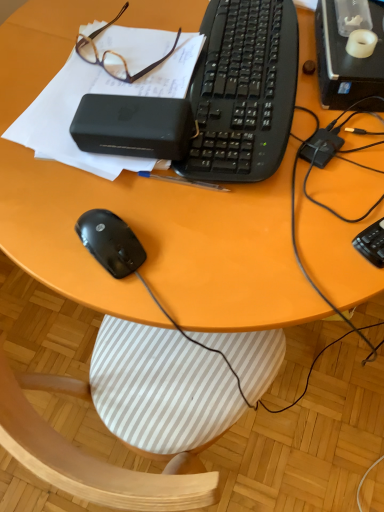
Locate an element on the screen. The image size is (384, 512). vacant space to the right of black matte mouse at lower left is located at coordinates (223, 239).